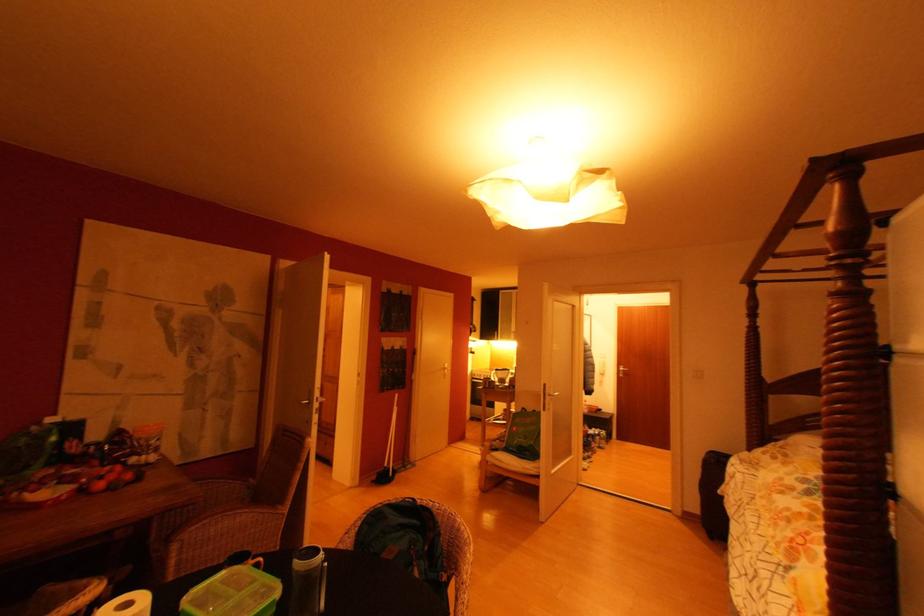
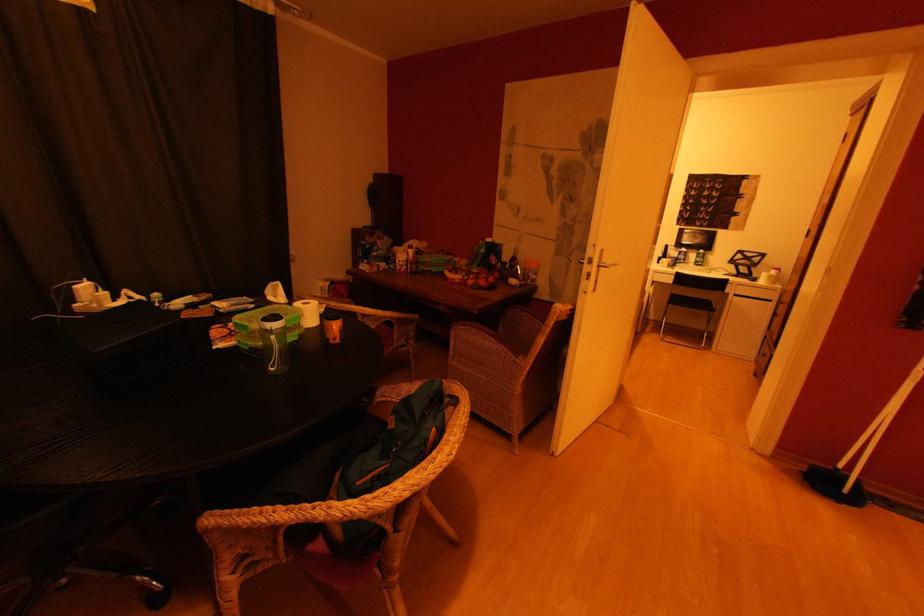
Find the pixel in the second image that matches pixel 134 477 in the first image.

(488, 285)